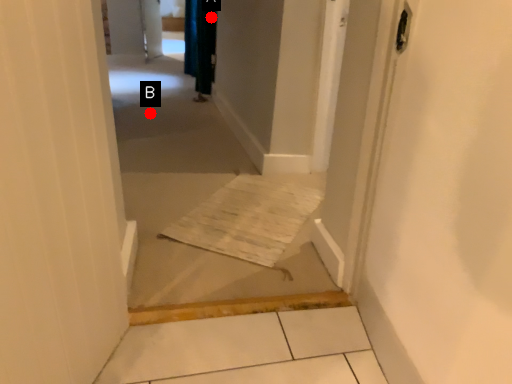
Question: Two points are circled on the image, labeled by A and B beside each circle. Which of the following is the farthest from the observer?

Choices:
 (A) A is further
 (B) B is further

Answer: (A)